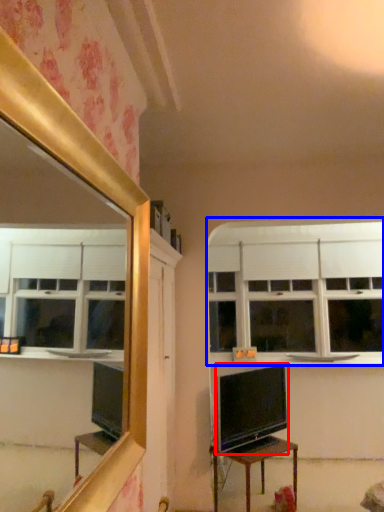
Question: Which point is closer to the camera, television (highlighted by a red box) or window (highlighted by a blue box)?

Choices:
 (A) television
 (B) window

Answer: (A)